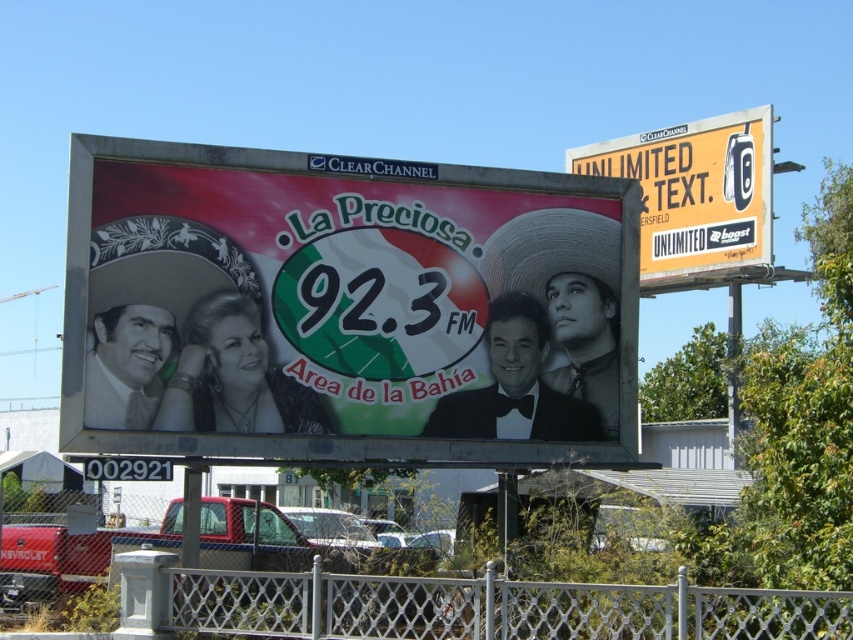
Can you confirm if matte plastic billboard at center is wider than yellow paper sign at upper right?

Correct, the width of matte plastic billboard at center exceeds that of yellow paper sign at upper right.

Is point (512, 413) behind point (659, 188)?

No, (512, 413) is in front of (659, 188).

At what (x,y) coordinates should I click in order to perform the action: click on matte plastic billboard at center. Please return your answer as a coordinate pair (x, y). The image size is (853, 640). Looking at the image, I should click on 344,307.